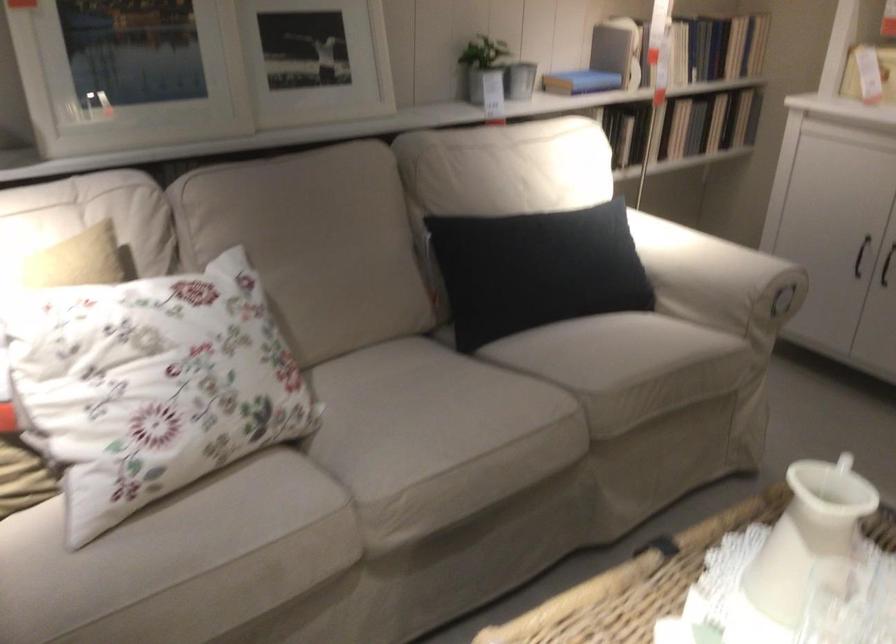
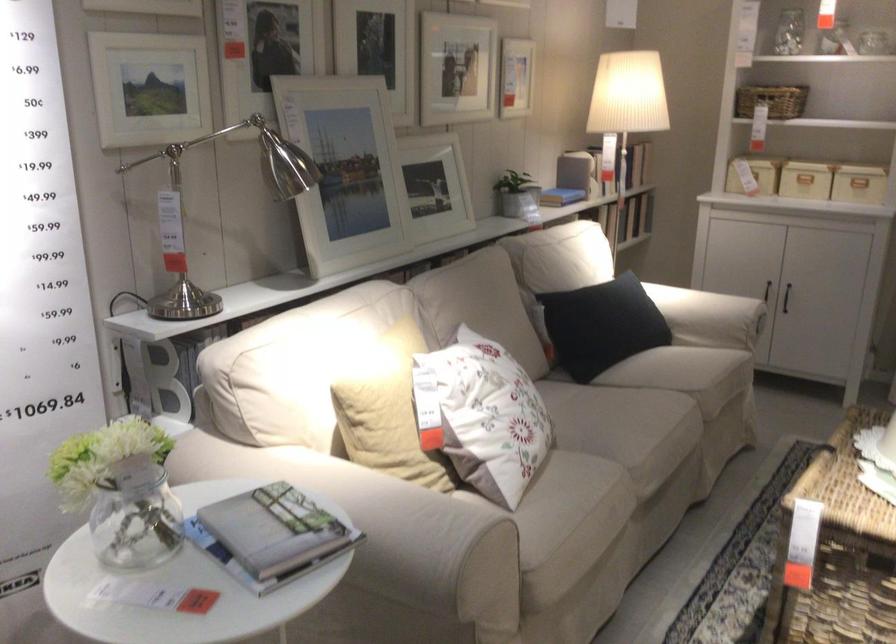
The point at (x=115, y=388) is marked in the first image. Where is the corresponding point in the second image?

(484, 415)